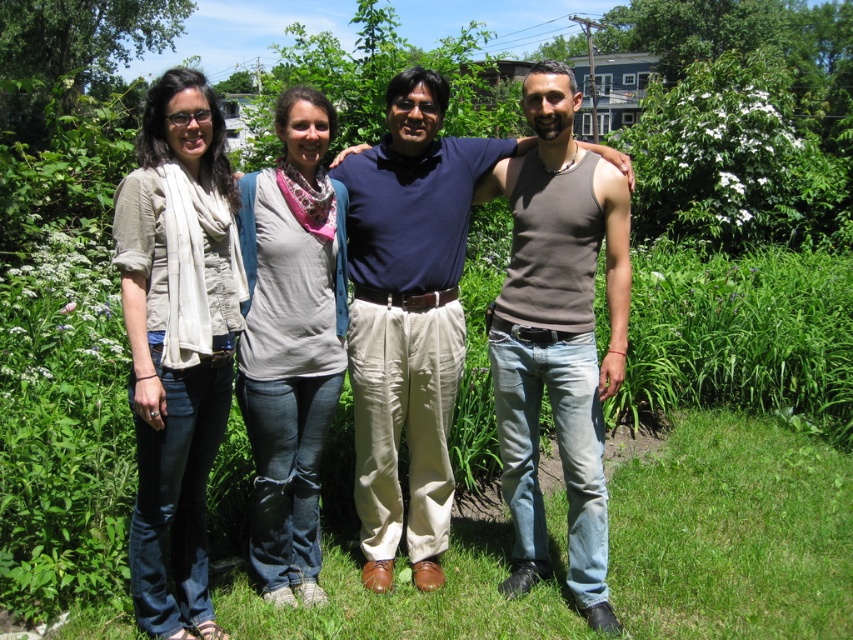
Is point (787, 506) behind point (550, 145)?

Yes, it is behind point (550, 145).

Does green grass at lower center lie behind brown cotton tank top at center?

No, green grass at lower center is in front of brown cotton tank top at center.

Between point (389, 600) and point (618, 237), which one is positioned behind?

Point (389, 600)

You are a GUI agent. You are given a task and a screenshot of the screen. Output one action in this format:
    pyautogui.click(x=<x>, y=<y>)
    Task: Click on the green grass at lower center
    
    Given the screenshot: What is the action you would take?
    pyautogui.click(x=732, y=532)

Which is below, green grass at lower center or matte beige scarf at left?

green grass at lower center is below.

Between green grass at lower center and matte beige scarf at left, which one has more height?

With more height is matte beige scarf at left.

Is point (549, 529) closer to viewer compared to point (190, 317)?

No, it is behind (190, 317).

Locate an element on the screen. Image resolution: width=853 pixels, height=640 pixels. green grass at lower center is located at coordinates (732, 532).

Who is taller, matte beige scarf at left or brown cotton tank top at right?

brown cotton tank top at right is taller.

Who is more distant from viewer, (138, 419) or (503, 330)?

Point (503, 330)

Identify the location of matte beige scarf at left. (177, 340).